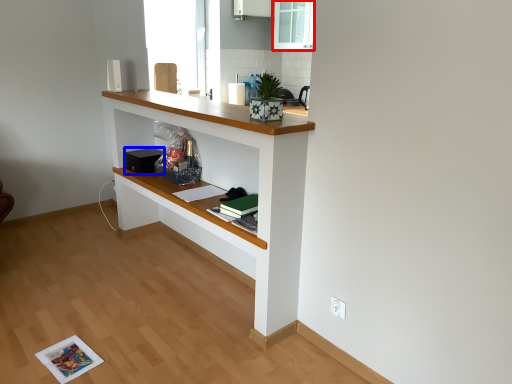
Question: Which point is closer to the camera, glass door (highlighted by a red box) or appliance (highlighted by a blue box)?

Choices:
 (A) glass door
 (B) appliance

Answer: (B)